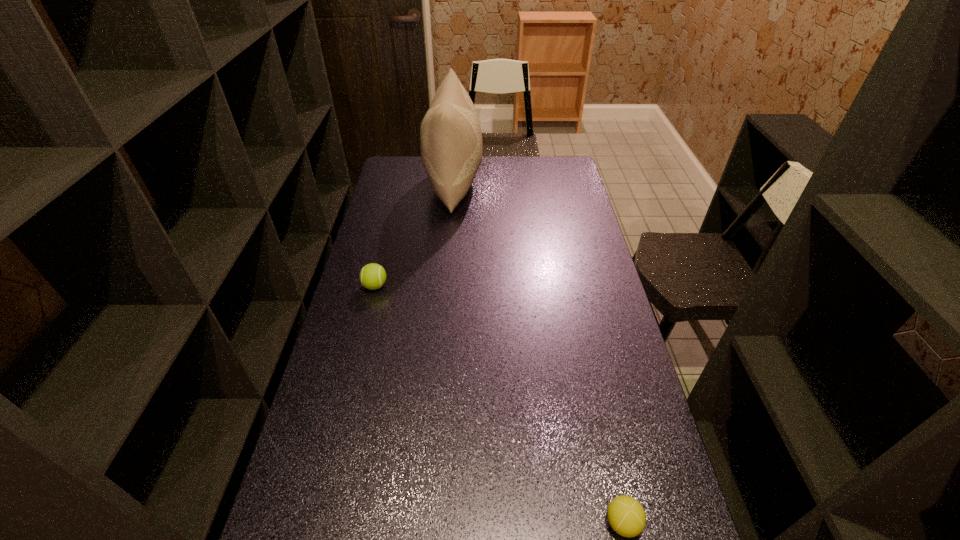
You are a GUI agent. You are given a task and a screenshot of the screen. Output one action in this format:
    pyautogui.click(x=<x>, y=<y>)
    Task: Click on the cushion
    
    Given the screenshot: What is the action you would take?
    pyautogui.click(x=450, y=135)

At what (x,y) coordinates should I click in order to perform the action: click on the second object from right to left. Please return your answer as a coordinate pair (x, y). Looking at the image, I should click on (450, 135).

Find the location of `the leftmost object`. the leftmost object is located at coordinates (372, 276).

At what (x,y) coordinates should I click in order to perform the action: click on the second nearest object. Please return your answer as a coordinate pair (x, y). The image size is (960, 540). Looking at the image, I should click on (372, 276).

Locate an element on the screen. This screenshot has height=540, width=960. free space located on the front side of the cushion is located at coordinates (528, 185).

The height and width of the screenshot is (540, 960). In order to click on blank space located 0.180m on the right of the left tennis ball in this screenshot , I will do `click(440, 286)`.

This screenshot has height=540, width=960. Identify the location of object present at the far edge. (450, 135).

The height and width of the screenshot is (540, 960). I want to click on object present at the left edge, so click(372, 276).

At what (x,y) coordinates should I click in order to perform the action: click on vacant space at the far edge of the desktop. Please return your answer as a coordinate pair (x, y). The image size is (960, 540). Looking at the image, I should click on (498, 157).

Image resolution: width=960 pixels, height=540 pixels. I want to click on blank area at the left edge, so click(410, 183).